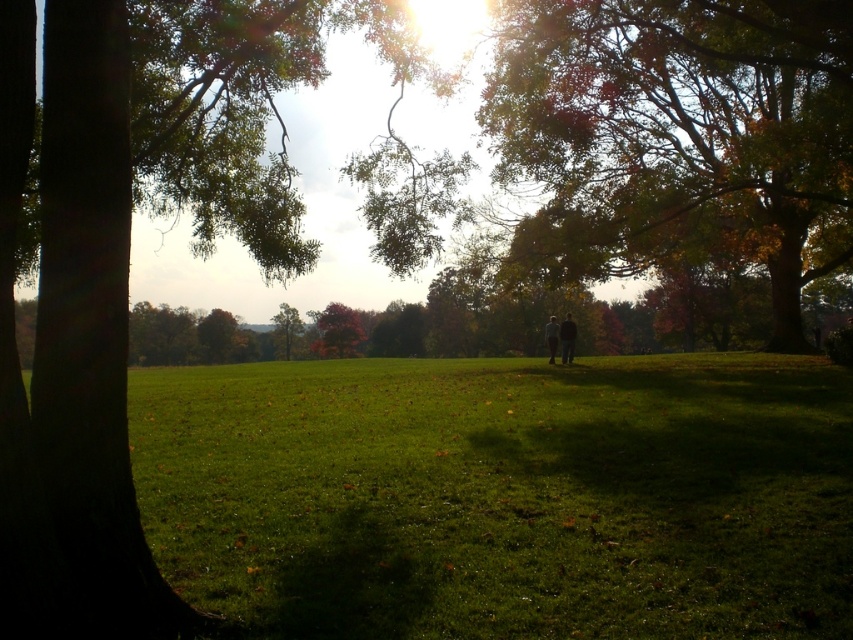
You are standing in the middle of the grassy field and see the autumn leaves at center and the green leafy tree at center. Which object is higher in the scene?

The autumn leaves at center are higher than the green leafy tree at center according to the description.